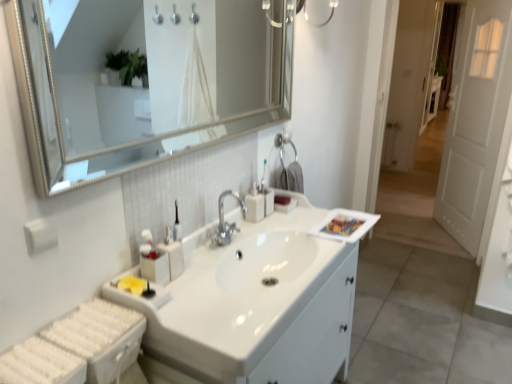
Measure the distance between point (263, 195) and camera.

The depth of point (263, 195) is 1.86 meters.

Find the location of a particular element. This screenshot has height=384, width=512. white wooden door at right is located at coordinates (475, 121).

The height and width of the screenshot is (384, 512). What are the coordinates of `beige plastic soap dispenser at center` in the screenshot? It's located at (254, 204).

This screenshot has width=512, height=384. What do you see at coordinates (254, 204) in the screenshot? I see `beige plastic soap dispenser at center` at bounding box center [254, 204].

What is the approximate width of white glossy sink at center?

white glossy sink at center is 19.82 inches in width.

This screenshot has height=384, width=512. I want to click on white glossy sink at center, so click(315, 336).

At what (x,y) coordinates should I click in order to perform the action: click on satin silver soap dispenser at center. Please return your answer as a coordinate pair (x, y). Looking at the image, I should click on pos(267,198).

Does beige plastic soap dispenser at center appear on the right side of silver/metallic mirror at upper center?

Indeed, beige plastic soap dispenser at center is positioned on the right side of silver/metallic mirror at upper center.

Looking at this image, from a real-world perspective, who is located higher, beige plastic soap dispenser at center or silver/metallic mirror at upper center?

In real-world perspective, silver/metallic mirror at upper center is above.

Where is `soap dispenser located behind the silver/metallic mirror at upper center`? Image resolution: width=512 pixels, height=384 pixels. soap dispenser located behind the silver/metallic mirror at upper center is located at coordinates (254, 204).

From the image's perspective, does beige plastic soap dispenser at center appear lower than silver/metallic mirror at upper center?

Yes.

Does silver/metallic mirror at upper center appear on the right side of white wooden door at right?

No, silver/metallic mirror at upper center is not to the right of white wooden door at right.

From the image's perspective, which object appears higher, silver/metallic mirror at upper center or white wooden door at right?

white wooden door at right.

From a real-world perspective, who is located higher, silver/metallic mirror at upper center or white wooden door at right?

From a 3D spatial view, silver/metallic mirror at upper center is above.

Is the depth of silver/metallic mirror at upper center less than that of white wooden door at right?

Yes.

Considering their positions, is white wooden door at right located in front of or behind white glossy sink at center?

Visually, white wooden door at right is located behind white glossy sink at center.

Looking at this image, from a real-world perspective, between white wooden door at right and white glossy sink at center, who is vertically higher?

In real-world perspective, white wooden door at right is above.

This screenshot has height=384, width=512. In order to click on bathroom cabinet on the left of white wooden door at right in this screenshot , I will do `click(315, 336)`.

From the image's perspective, is white wooden door at right below white glossy sink at center?

No, from the image's perspective, white wooden door at right is not below white glossy sink at center.

From a real-world perspective, which is physically above, beige plastic soap dispenser at center or satin silver soap dispenser at center?

satin silver soap dispenser at center.

How many degrees apart are the facing directions of beige plastic soap dispenser at center and satin silver soap dispenser at center?

The angle between the facing direction of beige plastic soap dispenser at center and the facing direction of satin silver soap dispenser at center is 0.00226 degrees.

Does beige plastic soap dispenser at center contain satin silver soap dispenser at center?

Actually, satin silver soap dispenser at center is outside beige plastic soap dispenser at center.

Measure the distance from beige plastic soap dispenser at center to satin silver soap dispenser at center.

beige plastic soap dispenser at center is 1.96 inches away from satin silver soap dispenser at center.

From a real-world perspective, between white glossy sink at center and silver/metallic mirror at upper center, who is vertically lower?

In real-world perspective, white glossy sink at center is lower.

From the image's perspective, is white glossy sink at center located above or below silver/metallic mirror at upper center?

Clearly, from the image's perspective, white glossy sink at center is below silver/metallic mirror at upper center.

Is white glossy sink at center inside the boundaries of silver/metallic mirror at upper center, or outside?

white glossy sink at center cannot be found inside silver/metallic mirror at upper center.

Consider the image. Can you confirm if white glossy sink at center is shorter than silver/metallic mirror at upper center?

In fact, white glossy sink at center may be taller than silver/metallic mirror at upper center.

Which of these two, silver/metallic mirror at upper center or satin silver soap dispenser at center, stands taller?

With more height is silver/metallic mirror at upper center.

In the scene shown: Does silver/metallic mirror at upper center have a greater width compared to satin silver soap dispenser at center?

No, silver/metallic mirror at upper center is not wider than satin silver soap dispenser at center.

Considering the relative sizes of silver/metallic mirror at upper center and satin silver soap dispenser at center in the image provided, is silver/metallic mirror at upper center bigger than satin silver soap dispenser at center?

Indeed, silver/metallic mirror at upper center has a larger size compared to satin silver soap dispenser at center.

Is beige plastic soap dispenser at center placed right next to white glossy sink at center?

No, beige plastic soap dispenser at center is not next to white glossy sink at center.

Which object is further away from the camera, beige plastic soap dispenser at center or white glossy sink at center?

beige plastic soap dispenser at center is behind.

From the image's perspective, who appears lower, beige plastic soap dispenser at center or white glossy sink at center?

white glossy sink at center appears lower in the image.

At what (x,y) coordinates should I click in order to perform the action: click on mirror located in front of the beige plastic soap dispenser at center. Please return your answer as a coordinate pair (x, y). Looking at the image, I should click on click(157, 75).

Locate an element on the screen. mirror that is above the white wooden door at right (from a real-world perspective) is located at coordinates (157, 75).

Considering their positions, is beige plastic soap dispenser at center positioned further to white wooden door at right than white glossy sink at center?

beige plastic soap dispenser at center.

Considering their positions, is white wooden door at right positioned closer to satin silver soap dispenser at center than white glossy sink at center?

white glossy sink at center lies closer to satin silver soap dispenser at center than the other object.

Based on their spatial positions, is beige plastic soap dispenser at center or white glossy sink at center further from silver/metallic mirror at upper center?

white glossy sink at center is positioned further to the anchor silver/metallic mirror at upper center.

Consider the image. Which object lies further to the anchor point beige plastic soap dispenser at center, satin silver soap dispenser at center or white wooden door at right?

white wooden door at right is positioned further to the anchor beige plastic soap dispenser at center.

Based on their spatial positions, is silver/metallic mirror at upper center or white glossy sink at center further from white wooden door at right?

The object further to white wooden door at right is silver/metallic mirror at upper center.

Looking at the image, which one is located closer to silver/metallic mirror at upper center, satin silver soap dispenser at center or white glossy sink at center?

satin silver soap dispenser at center.

Considering their positions, is satin silver soap dispenser at center positioned closer to beige plastic soap dispenser at center than white glossy sink at center?

Based on the image, satin silver soap dispenser at center appears to be nearer to beige plastic soap dispenser at center.

Looking at the image, which one is located further to satin silver soap dispenser at center, beige plastic soap dispenser at center or white wooden door at right?

white wooden door at right lies further to satin silver soap dispenser at center than the other object.

Where is `toiletry located between silver/metallic mirror at upper center and white wooden door at right in the left-right direction`? Image resolution: width=512 pixels, height=384 pixels. toiletry located between silver/metallic mirror at upper center and white wooden door at right in the left-right direction is located at coordinates (267, 198).

Image resolution: width=512 pixels, height=384 pixels. I want to click on bathroom cabinet between silver/metallic mirror at upper center and satin silver soap dispenser at center in the front-back direction, so [315, 336].

Locate an element on the screen. bathroom cabinet located between beige plastic soap dispenser at center and white wooden door at right in the left-right direction is located at coordinates (315, 336).

The width and height of the screenshot is (512, 384). I want to click on toiletry located between beige plastic soap dispenser at center and white wooden door at right in the left-right direction, so 267,198.